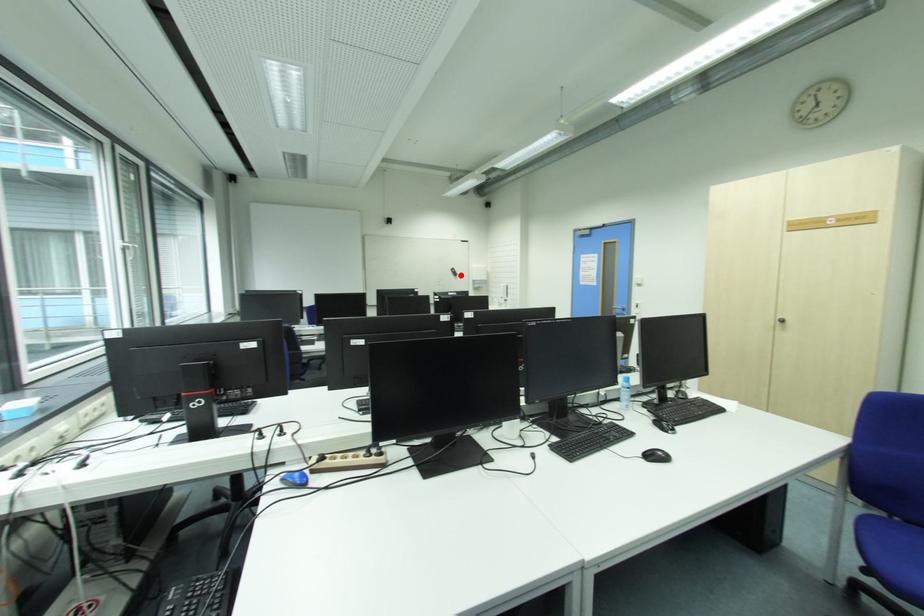
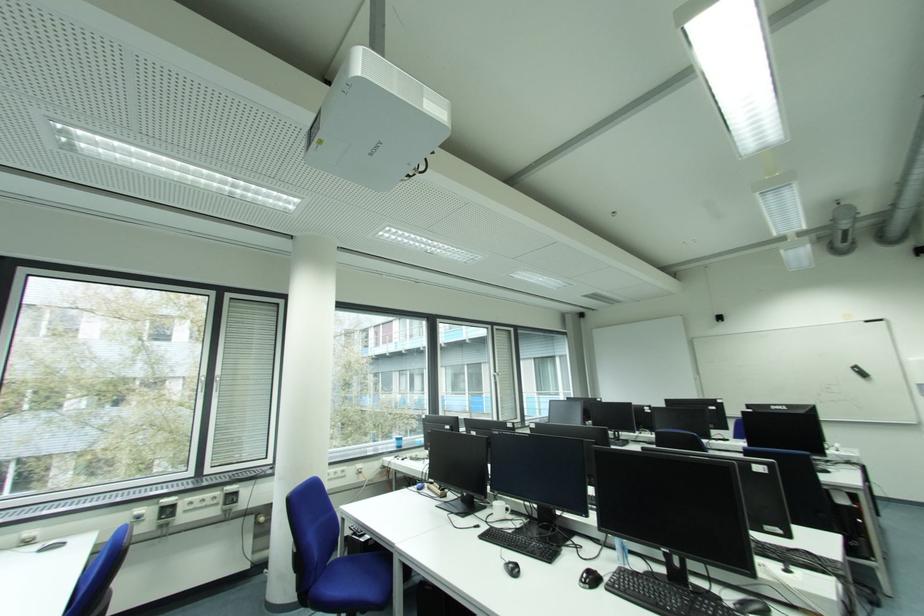
Question: I am providing you with two images of the same scene from different viewpoints. A red point is shown in image1. For the corresponding object point in image2, is it positioned nearer or farther from the camera?

Choices:
 (A) Nearer
 (B) Farther

Answer: (A)